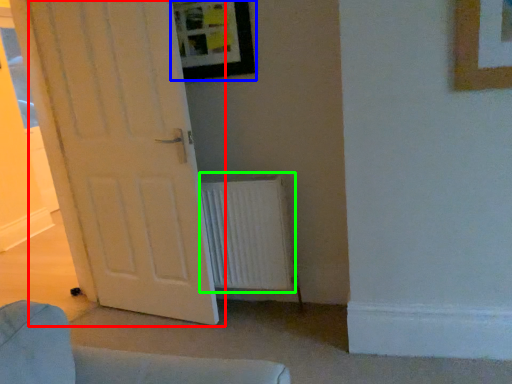
Question: Which object is the farthest from door (highlighted by a red box)? Choose among these: picture frame (highlighted by a blue box) or radiator (highlighted by a green box).

Choices:
 (A) picture frame
 (B) radiator

Answer: (A)